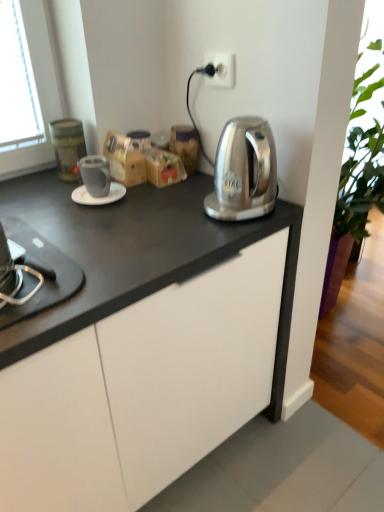
Find the location of a particular element. This screenshot has width=384, height=512. vacant area in front of white glossy saucer at center is located at coordinates coord(95,223).